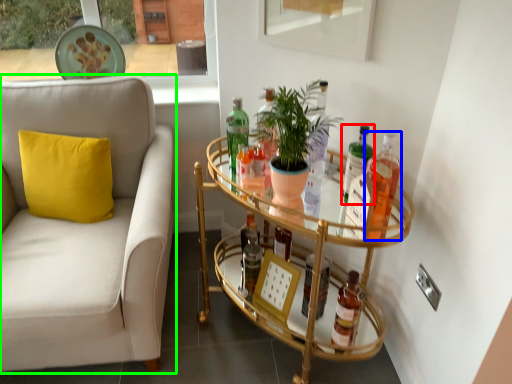
Question: Which is nearer to the bottle (highlighted by a red box)? bottle (highlighted by a blue box) or studio couch (highlighted by a green box).

Choices:
 (A) bottle
 (B) studio couch

Answer: (A)